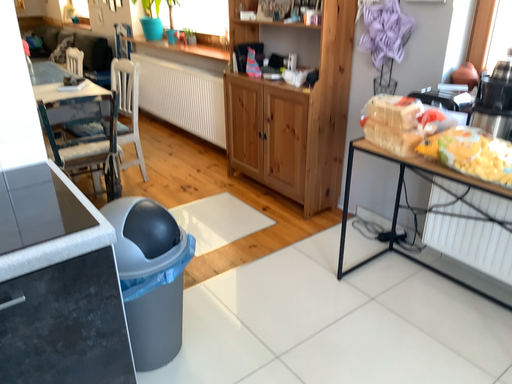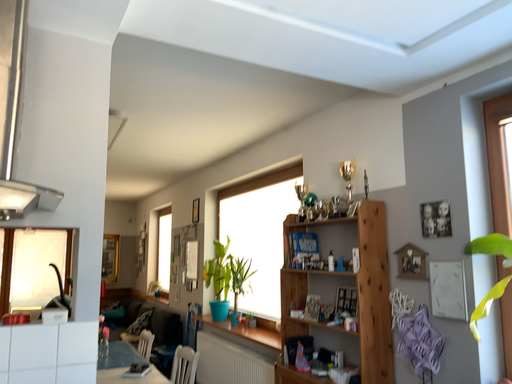
Question: Which way did the camera rotate in the video?

Choices:
 (A) rotated left
 (B) rotated right

Answer: (A)